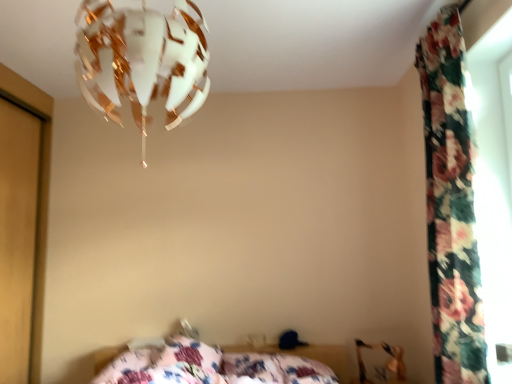
Question: Based on their positions, is metallic gold swivel chair at lower right located to the left or right of floral fabric curtain at right?

Choices:
 (A) left
 (B) right

Answer: (A)

Question: From a real-world perspective, is metallic gold swivel chair at lower right physically located above or below floral fabric curtain at right?

Choices:
 (A) below
 (B) above

Answer: (A)

Question: Which of these objects is positioned closest to the floral fabric curtain at right?

Choices:
 (A) white matte lampshade at upper center
 (B) metallic gold swivel chair at lower right
 (C) floral fabric pillow at lower center, marked as the 2th pillow in a right-to-left arrangement
 (D) floral fabric pillow at lower center, marked as the 1th pillow in a right-to-left arrangement

Answer: (B)

Question: Which object is positioned closest to the white matte lampshade at upper center?

Choices:
 (A) floral fabric pillow at lower center, marked as the 2th pillow in a right-to-left arrangement
 (B) floral fabric curtain at right
 (C) metallic gold swivel chair at lower right
 (D) floral fabric pillow at lower center, the 2th pillow from the left

Answer: (B)